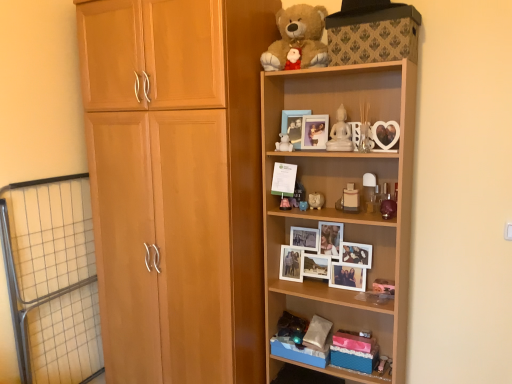
Question: Does clear glass vase at upper center, acting as the 6th toy starting from the left, turn towards white marble statue at upper center, positioned as the fourth toy in left-to-right order?

Choices:
 (A) yes
 (B) no

Answer: (B)

Question: From the image's perspective, is clear glass vase at upper center, which is the 1th toy from right to left, above white marble statue at upper center, positioned as the fourth toy in left-to-right order?

Choices:
 (A) yes
 (B) no

Answer: (B)

Question: Can you confirm if clear glass vase at upper center, which is the 1th toy from right to left, is wider than white marble statue at upper center, which is the 3th toy in right-to-left order?

Choices:
 (A) no
 (B) yes

Answer: (B)

Question: Is clear glass vase at upper center, which is the 1th toy from right to left, positioned with its back to white marble statue at upper center, which is the 3th toy in right-to-left order?

Choices:
 (A) yes
 (B) no

Answer: (B)

Question: From the image's perspective, is clear glass vase at upper center, acting as the 6th toy starting from the left, under white marble statue at upper center, positioned as the fourth toy in left-to-right order?

Choices:
 (A) no
 (B) yes

Answer: (B)

Question: Considering the relative sizes of clear glass vase at upper center, acting as the 6th toy starting from the left, and white marble statue at upper center, which is the 3th toy in right-to-left order, in the image provided, is clear glass vase at upper center, acting as the 6th toy starting from the left, smaller than white marble statue at upper center, which is the 3th toy in right-to-left order,?

Choices:
 (A) no
 (B) yes

Answer: (A)

Question: Is light brown wood cupboard at left closer to the viewer compared to metal grid screen door at left?

Choices:
 (A) no
 (B) yes

Answer: (B)

Question: Would you say light brown wood cupboard at left contains metal grid screen door at left?

Choices:
 (A) no
 (B) yes

Answer: (A)

Question: Does light brown wood cupboard at left have a lesser height compared to metal grid screen door at left?

Choices:
 (A) yes
 (B) no

Answer: (B)

Question: Is light brown wood cupboard at left further to the viewer compared to metal grid screen door at left?

Choices:
 (A) no
 (B) yes

Answer: (A)

Question: Is light brown wood cupboard at left positioned with its back to metal grid screen door at left?

Choices:
 (A) yes
 (B) no

Answer: (B)

Question: Does light brown wood cupboard at left have a larger size compared to metal grid screen door at left?

Choices:
 (A) yes
 (B) no

Answer: (A)

Question: Is clear glass vase at upper center, which is the 1th toy from right to left, closer to camera compared to soft brown plush at upper center?

Choices:
 (A) yes
 (B) no

Answer: (B)